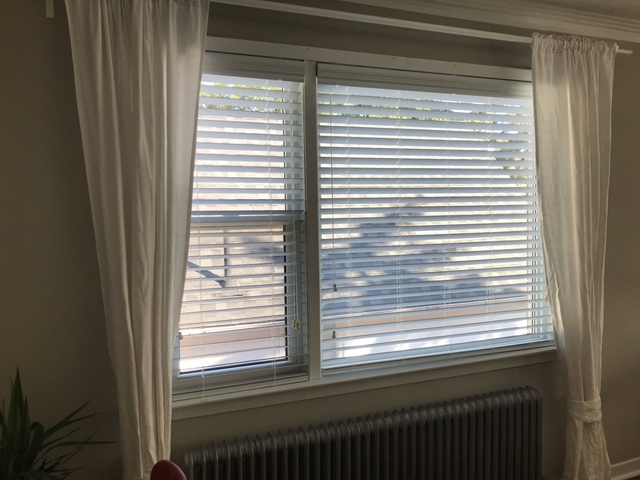
I want to click on ceiling, so click(612, 7).